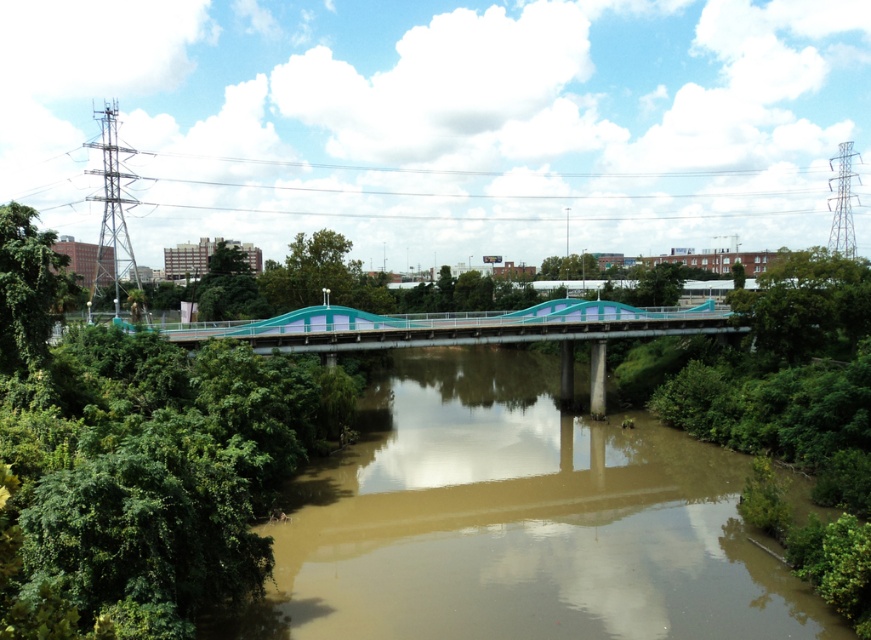
You are a bird flying over the urban landscape and see the brown muddy water at center and the green leafy tree at center. Which object is positioned higher from the ground?

The green leafy tree at center is positioned higher from the ground than the brown muddy water at center, which is located below it.

You are standing on the bridge and want to take a photo of the green leafy tree at left and the green leafy tree at center. Which tree should you zoom in more on to capture its full details?

You should zoom in more on the green leafy tree at left because it is thinner than the green leafy tree at center, so it may require more focus to capture its details.

You are a photographer standing at the camera position. You want to capture a closeup shot of the brown muddy water at center. Considering your current distance, do you think you can get a clear closeup without moving closer?

The brown muddy water at center and camera are 28.59 meters apart. To capture a clear closeup shot from that distance, you would need a telephoto lens to avoid moving closer. Without a telephoto lens, the details might be too small or blurry.